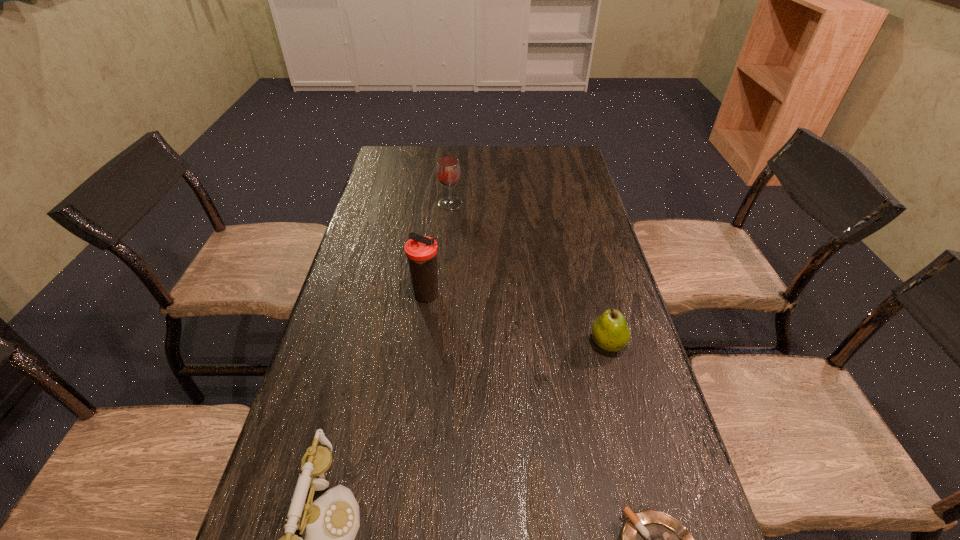
Identify the location of free location that satisfies the following two spatial constraints: 1. on the back side of the farthest object; 2. on the right side of the tallest object. (439, 204).